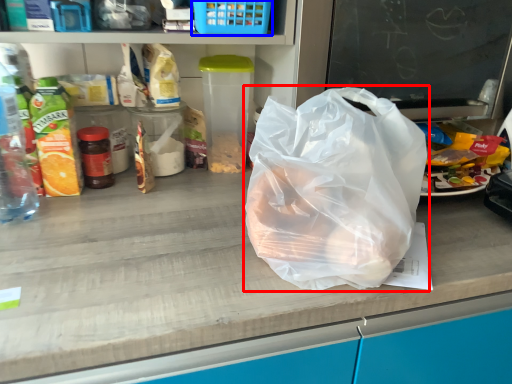
Question: Which point is further to the camera, plastic bag (highlighted by a red box) or basket (highlighted by a blue box)?

Choices:
 (A) plastic bag
 (B) basket

Answer: (B)